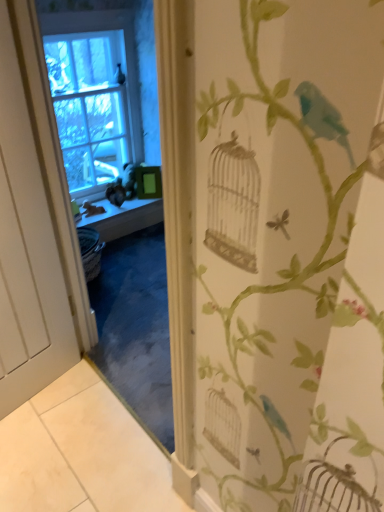
Question: Does white matte door at left come behind smooth wooden window sill at center?

Choices:
 (A) yes
 (B) no

Answer: (B)

Question: Does white matte door at left appear on the left side of smooth wooden window sill at center?

Choices:
 (A) no
 (B) yes

Answer: (B)

Question: From the image's perspective, is white matte door at left above smooth wooden window sill at center?

Choices:
 (A) yes
 (B) no

Answer: (B)

Question: Could smooth wooden window sill at center be considered to be inside white matte door at left?

Choices:
 (A) no
 (B) yes

Answer: (A)

Question: From the image's perspective, would you say white matte door at left is shown under smooth wooden window sill at center?

Choices:
 (A) no
 (B) yes

Answer: (B)

Question: Considering the relative positions of white matte door at left and smooth wooden window sill at center in the image provided, is white matte door at left in front of smooth wooden window sill at center?

Choices:
 (A) no
 (B) yes

Answer: (B)

Question: Is smooth wooden window sill at center bigger than clear glass window at upper left?

Choices:
 (A) yes
 (B) no

Answer: (B)

Question: From the image's perspective, does smooth wooden window sill at center appear lower than clear glass window at upper left?

Choices:
 (A) yes
 (B) no

Answer: (A)

Question: From the image's perspective, is smooth wooden window sill at center above clear glass window at upper left?

Choices:
 (A) yes
 (B) no

Answer: (B)

Question: Does smooth wooden window sill at center appear on the right side of clear glass window at upper left?

Choices:
 (A) no
 (B) yes

Answer: (B)

Question: Is there a large distance between smooth wooden window sill at center and clear glass window at upper left?

Choices:
 (A) no
 (B) yes

Answer: (A)

Question: Is the depth of smooth wooden window sill at center greater than that of clear glass window at upper left?

Choices:
 (A) yes
 (B) no

Answer: (A)

Question: Is clear glass window at upper left at the back of white matte door at left?

Choices:
 (A) yes
 (B) no

Answer: (B)